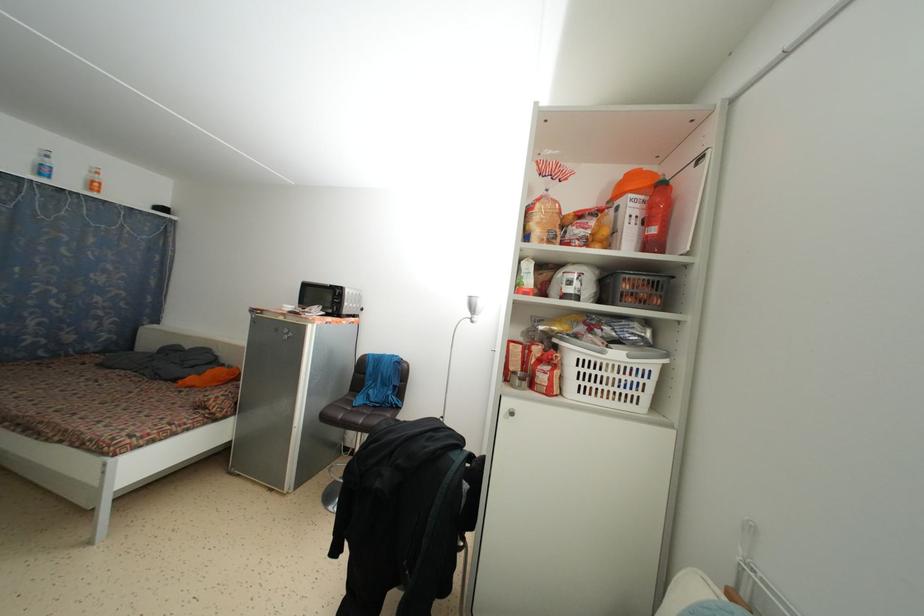
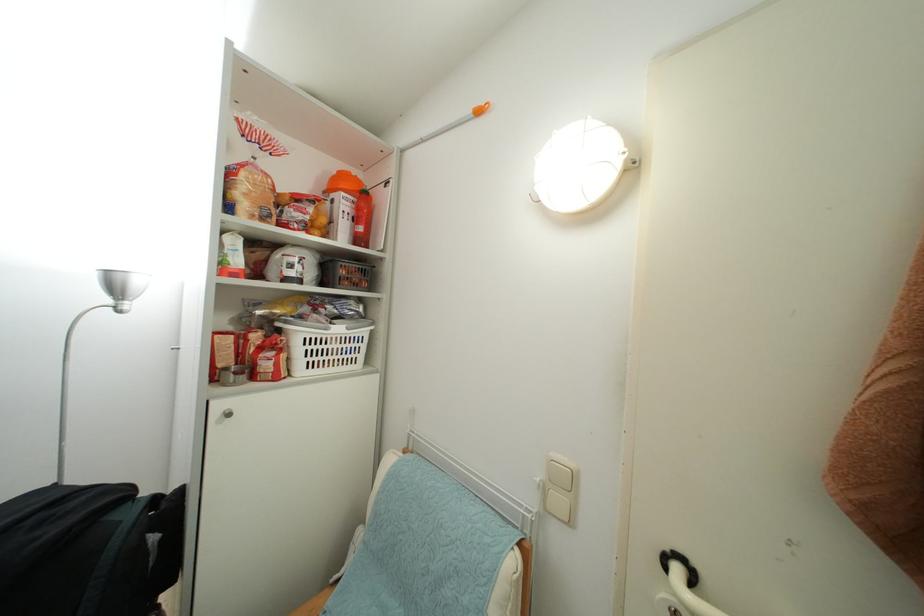
In the second image, find the point that corresponds to the point at 512,408 in the first image.

(224, 411)